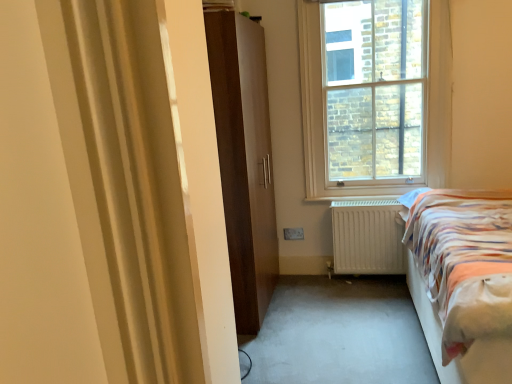
Question: Should I look upward or downward to see matte brown wardrobe at center?

Choices:
 (A) up
 (B) down

Answer: (A)

Question: Is the depth of matte brown wardrobe at center greater than that of striped fabric bed at right?

Choices:
 (A) yes
 (B) no

Answer: (A)

Question: Is matte brown wardrobe at center completely or partially outside of striped fabric bed at right?

Choices:
 (A) no
 (B) yes

Answer: (B)

Question: Can striped fabric bed at right be found inside matte brown wardrobe at center?

Choices:
 (A) no
 (B) yes

Answer: (A)

Question: From a real-world perspective, is matte brown wardrobe at center physically below striped fabric bed at right?

Choices:
 (A) no
 (B) yes

Answer: (A)

Question: Can you confirm if matte brown wardrobe at center is wider than striped fabric bed at right?

Choices:
 (A) no
 (B) yes

Answer: (A)

Question: From a real-world perspective, is matte brown wardrobe at center physically above striped fabric bed at right?

Choices:
 (A) no
 (B) yes

Answer: (B)

Question: Could you tell me if white matte radiator at lower center is turned towards clear glass window at upper center?

Choices:
 (A) no
 (B) yes

Answer: (A)

Question: Is white matte radiator at lower center turned away from clear glass window at upper center?

Choices:
 (A) no
 (B) yes

Answer: (A)

Question: Is white matte radiator at lower center surrounding clear glass window at upper center?

Choices:
 (A) yes
 (B) no

Answer: (B)

Question: Is white matte radiator at lower center with clear glass window at upper center?

Choices:
 (A) no
 (B) yes

Answer: (A)

Question: Is white matte radiator at lower center positioned beyond the bounds of clear glass window at upper center?

Choices:
 (A) no
 (B) yes

Answer: (B)

Question: Is white matte radiator at lower center not near clear glass window at upper center?

Choices:
 (A) yes
 (B) no

Answer: (B)

Question: Does white matte radiator at lower center have a lesser height compared to matte brown wardrobe at center?

Choices:
 (A) no
 (B) yes

Answer: (B)